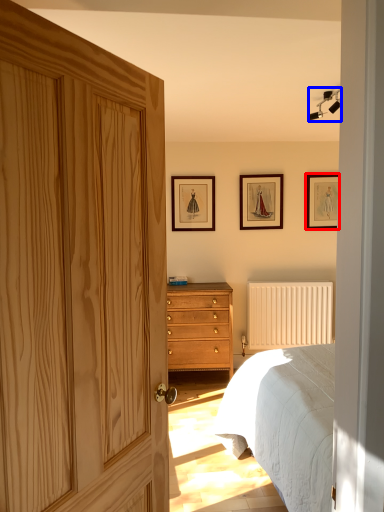
Question: Which of the following is the closest to the observer, picture frame (highlighted by a red box) or light fixture (highlighted by a blue box)?

Choices:
 (A) picture frame
 (B) light fixture

Answer: (B)